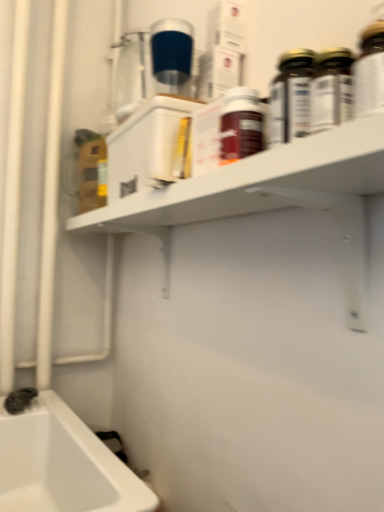
Question: Considering the positions of white matte shelf at upper center and matte brown bottle at center, the 2th bottle when ordered from right to left, in the image, is white matte shelf at upper center taller or shorter than matte brown bottle at center, the 2th bottle when ordered from right to left,?

Choices:
 (A) short
 (B) tall

Answer: (B)

Question: Looking at the image, does white matte shelf at upper center seem bigger or smaller compared to matte brown bottle at center, acting as the 2th bottle starting from the top?

Choices:
 (A) big
 (B) small

Answer: (A)

Question: Estimate the real-world distances between objects in this image. Which object is farther from the white matte shelf at upper center?

Choices:
 (A) gold metallic bottle at upper right, the 2th bottle from the bottom
 (B) black rubber faucet at lower left
 (C) matte brown bottle at center, which ranks as the first bottle in front-to-back order

Answer: (B)

Question: Estimate the real-world distances between objects in this image. Which object is farther from the white matte shelf at upper center?

Choices:
 (A) gold metallic bottle at upper right, the 2th bottle from the bottom
 (B) black rubber faucet at lower left
 (C) matte brown bottle at center, which ranks as the first bottle in front-to-back order

Answer: (B)